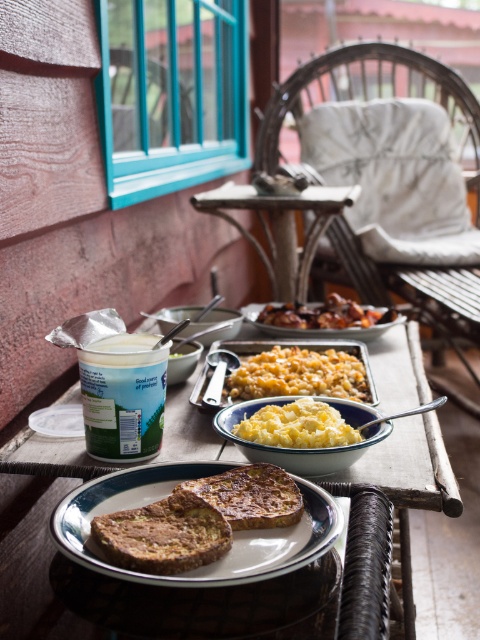
Question: Based on their relative distances, which object is farther from the wicker chair at center?

Choices:
 (A) white wood picnic table at center
 (B) brown toasted bread at center
 (C) golden crispy fried chicken at center
 (D) yellow creamy macaroni at center

Answer: (B)

Question: Is yellow creamy macaroni at center below golden crispy fried chicken at center?

Choices:
 (A) yes
 (B) no

Answer: (A)

Question: Does green matte yogurt at center have a lesser width compared to yellowish matte cornbread at center?

Choices:
 (A) no
 (B) yes

Answer: (B)

Question: Estimate the real-world distances between objects in this image. Which object is closer to the green matte yogurt at center?

Choices:
 (A) golden crispy fried chicken at center
 (B) wicker chair at center
 (C) yellowish matte cornbread at center
 (D) brown toasted bread at center

Answer: (D)

Question: Can you confirm if green matte yogurt at center is thinner than golden crispy fried chicken at center?

Choices:
 (A) yes
 (B) no

Answer: (A)

Question: Which of these objects is positioned farthest from the white wood picnic table at center?

Choices:
 (A) brown toasted bread at center
 (B) green matte yogurt at center

Answer: (B)